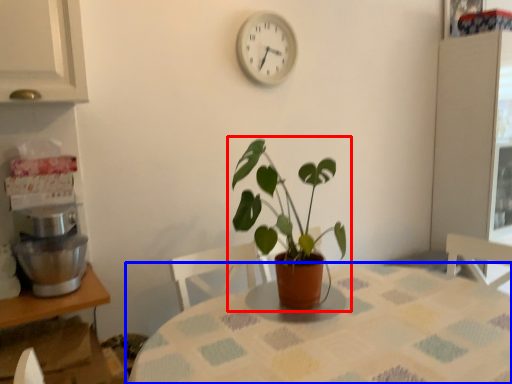
Question: Which object appears farthest to the camera in this image, houseplant (highlighted by a red box) or table (highlighted by a blue box)?

Choices:
 (A) houseplant
 (B) table

Answer: (A)